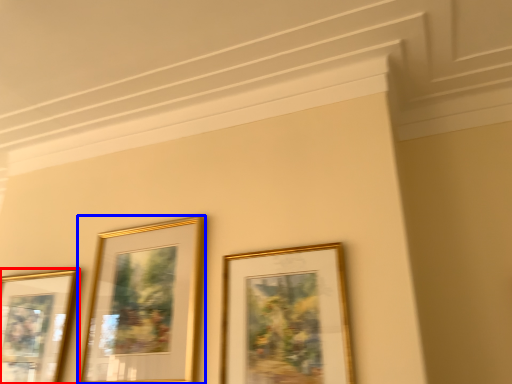
Question: Which object is further to the camera taking this photo, picture frame (highlighted by a red box) or picture frame (highlighted by a blue box)?

Choices:
 (A) picture frame
 (B) picture frame

Answer: (A)